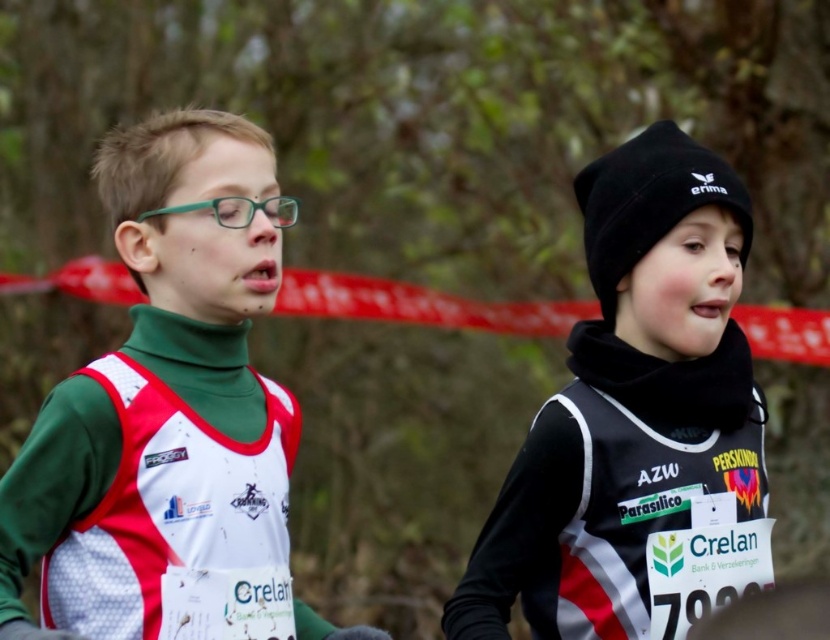
You are a race official at a cross country race. You need to determine the position of two runners based on their coordinates. The first runner is at point (675, 433) and the second runner is at point (222, 385). According to the race rules, the runner who is further ahead along the course is the winner. Which runner is in the leading position?

Point (675, 433) is behind point (222, 385), so the runner at point (222, 385) is in the leading position.

You are standing at the starting line of the cross country race. There is a point marked at coordinates point [13,602]. If you want to reach that point quickly, should you sprint straight ahead or move sideways?

Since the distance of point [13,602] from viewer is 3.26 meters, you should sprint straight ahead towards it to cover the distance quickly rather than moving sideways which would not reduce the distance.